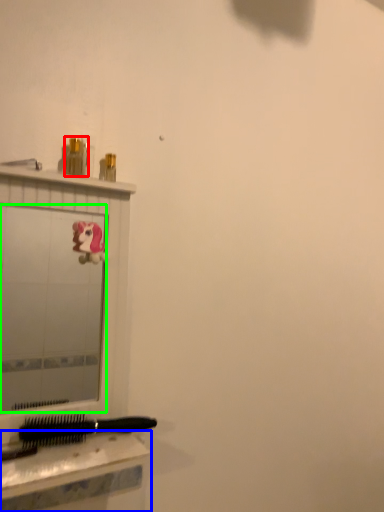
Question: Considering the real-world distances, which object is farthest from toiletry (highlighted by a red box)? table (highlighted by a blue box) or mirror (highlighted by a green box)?

Choices:
 (A) table
 (B) mirror

Answer: (B)